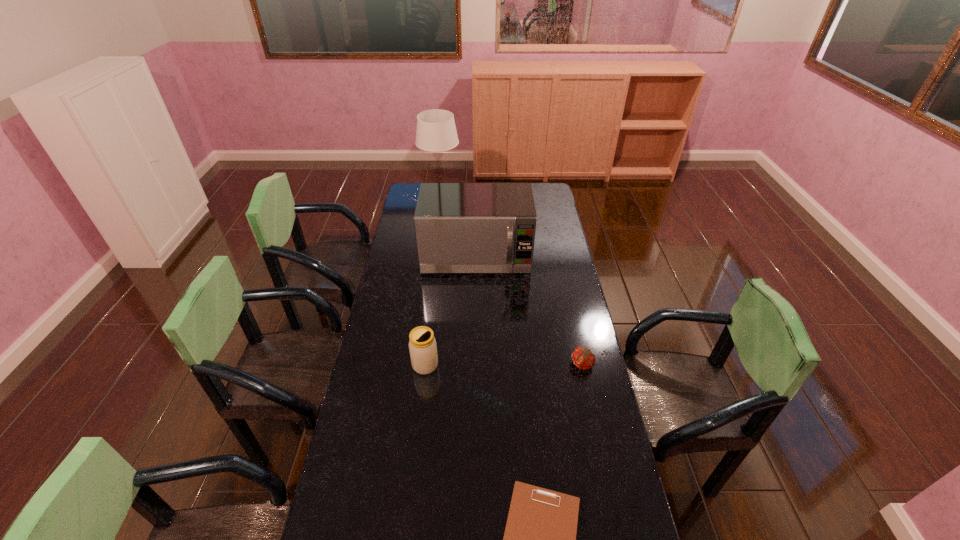
Where is `the tallest object`? the tallest object is located at coordinates (436, 131).

I want to click on the farthest object, so click(x=436, y=131).

The height and width of the screenshot is (540, 960). In order to click on the fourth nearest object in this screenshot , I will do `click(460, 227)`.

Find the location of a particular element. The image size is (960, 540). the second tallest object is located at coordinates (460, 227).

I want to click on the third tallest object, so click(422, 345).

Where is `the fourth tallest object`? The image size is (960, 540). the fourth tallest object is located at coordinates (583, 358).

This screenshot has height=540, width=960. Identify the location of tomato. pos(583,358).

At what (x,y) coordinates should I click in order to perform the action: click on vacant area located on the front-facing side of the table lamp. Please return your answer as a coordinate pair (x, y). Looking at the image, I should click on (x=513, y=198).

Find the location of a particular element. free space located with the door open on the fourth nearest object is located at coordinates (475, 309).

Image resolution: width=960 pixels, height=540 pixels. I want to click on vacant area located on the right of the third shortest object, so click(476, 365).